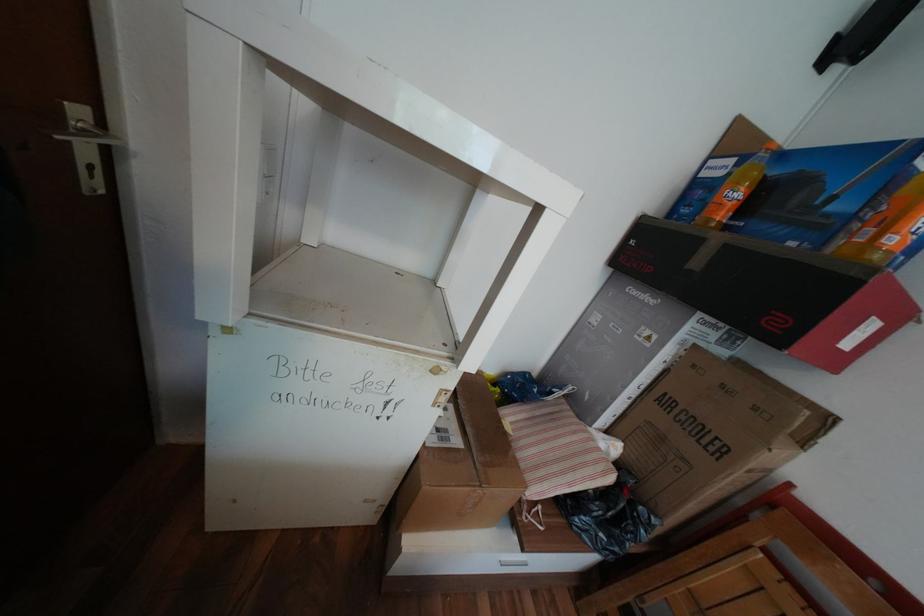
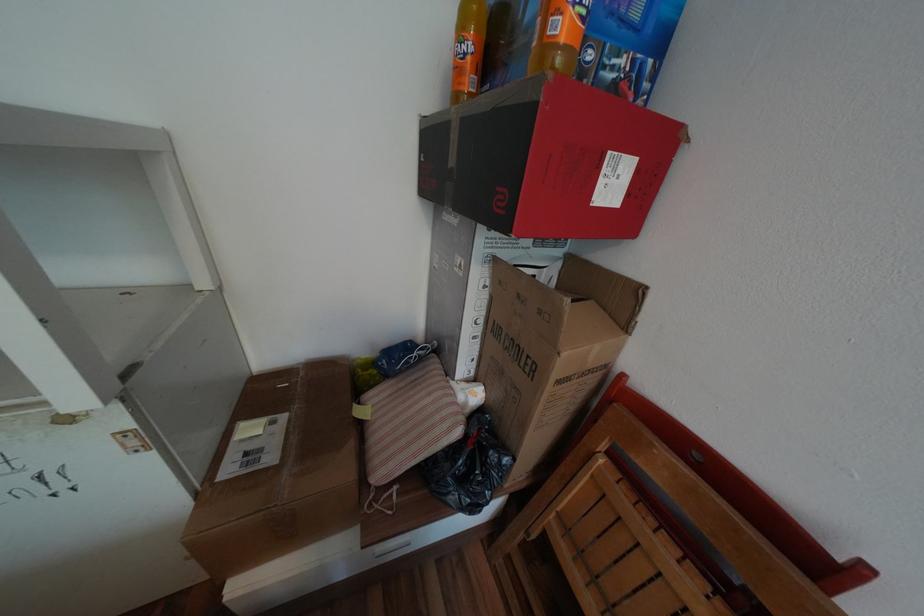
The point at (747, 184) is marked in the first image. Where is the corresponding point in the second image?

(472, 31)